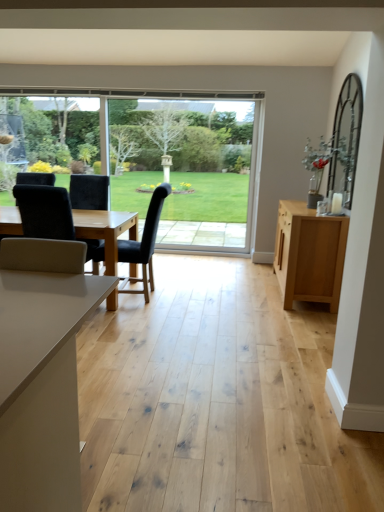
Question: Does clear glass window at center have a larger size compared to light wood cabinet at right?

Choices:
 (A) yes
 (B) no

Answer: (B)

Question: Is clear glass window at center thinner than light wood cabinet at right?

Choices:
 (A) no
 (B) yes

Answer: (B)

Question: Is clear glass window at center surrounding light wood cabinet at right?

Choices:
 (A) no
 (B) yes

Answer: (A)

Question: Can you confirm if clear glass window at center is smaller than light wood cabinet at right?

Choices:
 (A) yes
 (B) no

Answer: (A)

Question: Considering the relative positions of clear glass window at center and light wood cabinet at right in the image provided, is clear glass window at center to the right of light wood cabinet at right from the viewer's perspective?

Choices:
 (A) yes
 (B) no

Answer: (B)

Question: Is clear glass window at center shorter than light wood cabinet at right?

Choices:
 (A) yes
 (B) no

Answer: (B)

Question: Can you confirm if velvet black chair at left, which appears as the 1th chair when viewed from the left, is smaller than light wood cabinet at right?

Choices:
 (A) yes
 (B) no

Answer: (A)

Question: Could you tell me if velvet black chair at left, which appears as the 1th chair when viewed from the left, is facing light wood cabinet at right?

Choices:
 (A) yes
 (B) no

Answer: (B)

Question: Does velvet black chair at left, which appears as the 1th chair when viewed from the left, have a greater height compared to light wood cabinet at right?

Choices:
 (A) no
 (B) yes

Answer: (A)

Question: Can you confirm if velvet black chair at left, the second chair in the right-to-left sequence, is wider than light wood cabinet at right?

Choices:
 (A) yes
 (B) no

Answer: (A)

Question: Would you say velvet black chair at left, which appears as the 1th chair when viewed from the left, is outside light wood cabinet at right?

Choices:
 (A) no
 (B) yes

Answer: (B)

Question: From the image's perspective, does velvet black chair at left, which appears as the 1th chair when viewed from the left, appear higher than light wood cabinet at right?

Choices:
 (A) no
 (B) yes

Answer: (B)

Question: Considering the relative positions of velvet black chair at left, the second chair in the right-to-left sequence, and clear glass window at center in the image provided, is velvet black chair at left, the second chair in the right-to-left sequence, behind clear glass window at center?

Choices:
 (A) no
 (B) yes

Answer: (A)